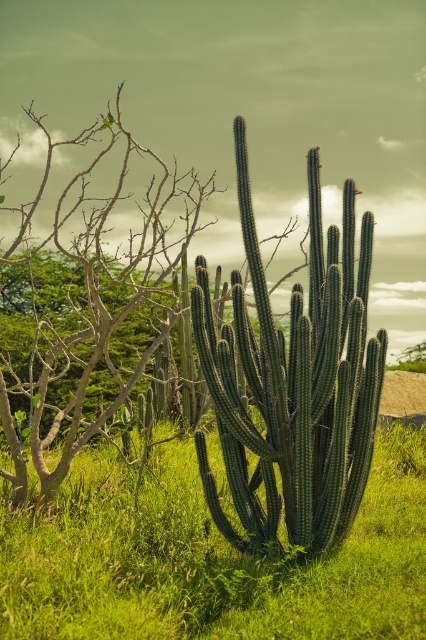
Does green matte cactus at center have a greater width compared to green matte tree at center?

No, green matte cactus at center is not wider than green matte tree at center.

Who is shorter, green matte cactus at center or green matte tree at center?

green matte cactus at center

Which is in front, point (184, 564) or point (80, 428)?

Point (184, 564) is more forward.

At what (x,y) coordinates should I click in order to perform the action: click on green matte cactus at center. Please return your answer as a coordinate pair (x, y). Image resolution: width=426 pixels, height=640 pixels. Looking at the image, I should click on (210, 560).

Who is lower down, green matte cactus at center or green spiny cactus at center?

Positioned lower is green matte cactus at center.

The image size is (426, 640). In order to click on green matte cactus at center in this screenshot , I will do `click(210, 560)`.

Who is more distant from viewer, (x=144, y=593) or (x=314, y=198)?

The point (x=314, y=198) is behind.

This screenshot has width=426, height=640. Identify the location of green matte cactus at center. (210, 560).

Does green spiny cactus at center have a lesser height compared to green matte tree at center?

Correct, green spiny cactus at center is not as tall as green matte tree at center.

Does green spiny cactus at center appear over green matte tree at center?

Incorrect, green spiny cactus at center is not positioned above green matte tree at center.

Is point (316, 237) closer to camera compared to point (43, 426)?

That is True.

This screenshot has height=640, width=426. Identify the location of green spiny cactus at center. (296, 380).